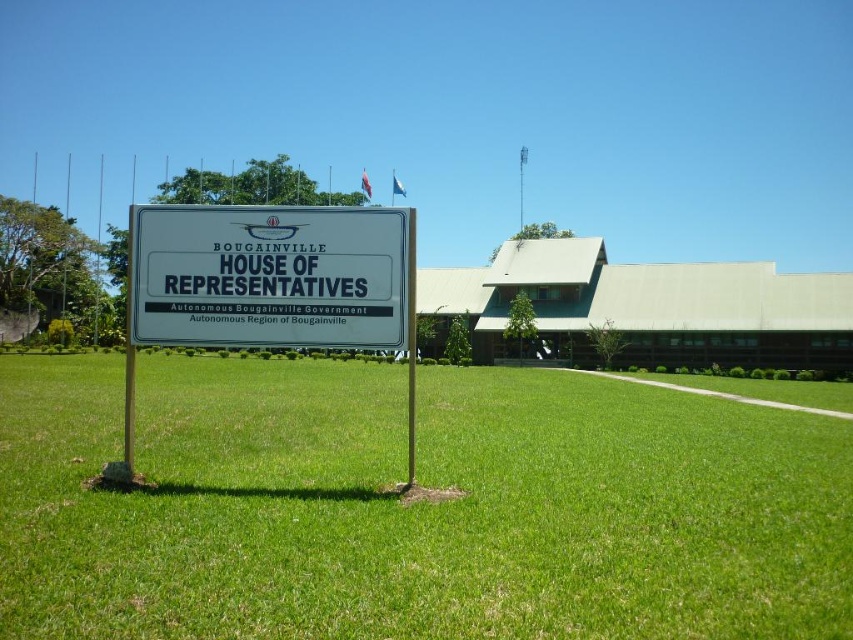
You are standing at the entrance of Bougainville House of Representatives and see the green grass at center and the white plastic sign at center. Which object is located to the right of the other?

The green grass at center is to the right of the white plastic sign at center.

You are standing at the sign in front of Bougainville House of Representatives and want to walk to the point labeled point (387,340). Is the point (631,442) closer to you than the point you want to go to?

Point (631,442) is further to the camera than point (387,340), so the point you want to go to is closer to you than point (631,442).